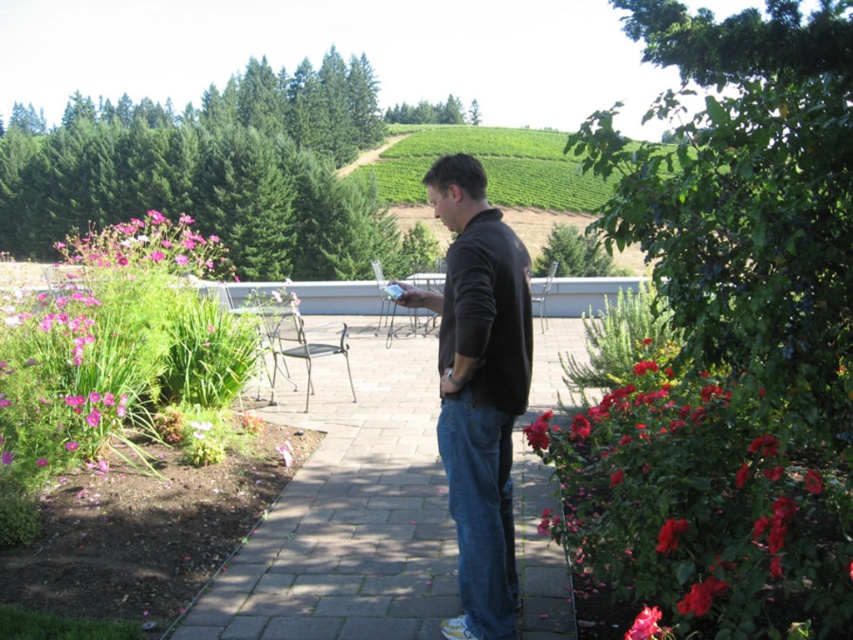
You are standing in the garden and want to take a photo of both the pink matte flowers at upper left and the red matte rose at center right in the same frame. Given that your camera has a maximum focus range of 30 meters, will you be able to capture both objects clearly in one shot?

The pink matte flowers at upper left is 30.16 meters away from the red matte rose at center right. Since the distance between them exceeds the camera maximum focus range of 30 meters, you won not be able to capture both objects clearly in one shot.

You are a gardener who wants to plant a new flower bed. You have two options for placement based on the current arrangement of pink matte flowers at upper left and red matte rose at center right. If you want to place a new flower that requires more space, which area should you choose?

The pink matte flowers at upper left might be wider than red matte rose at center right, so you should choose the area of pink matte flowers at upper left for the new flower that requires more space.

You are standing at point (712, 593) and want to walk to point (167, 256). Is there any obstruction between your current position and the destination?

Point (167, 256) is behind point (712, 593), so there is an obstruction between them.